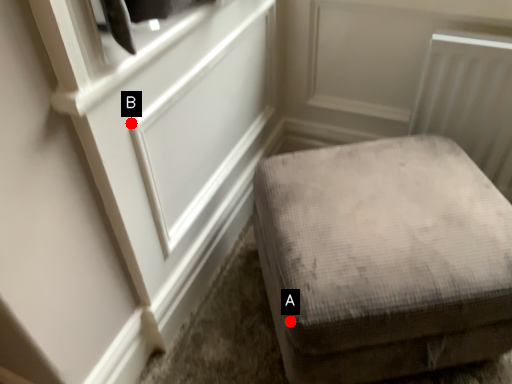
Question: Two points are circled on the image, labeled by A and B beside each circle. Which of the following is the farthest from the observer?

Choices:
 (A) A is further
 (B) B is further

Answer: (A)